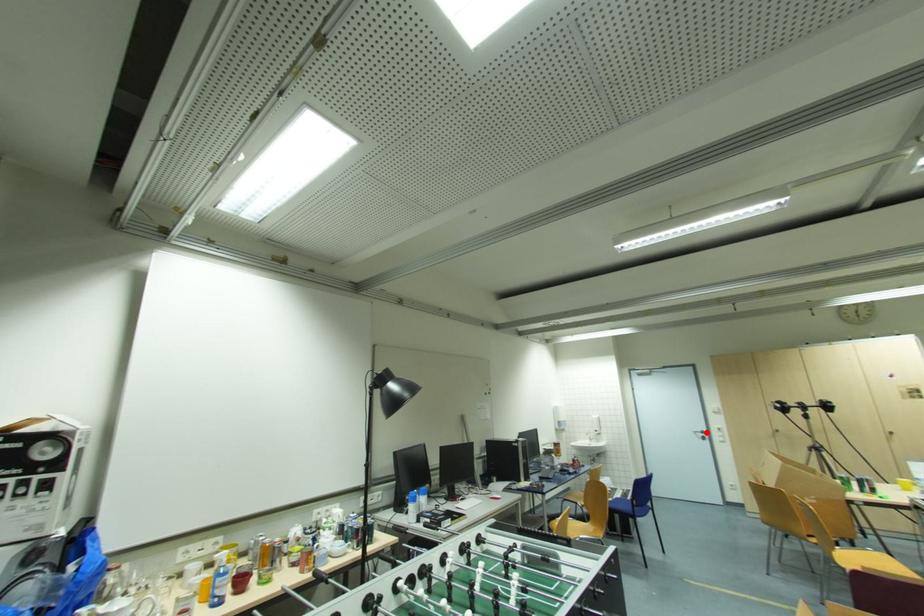
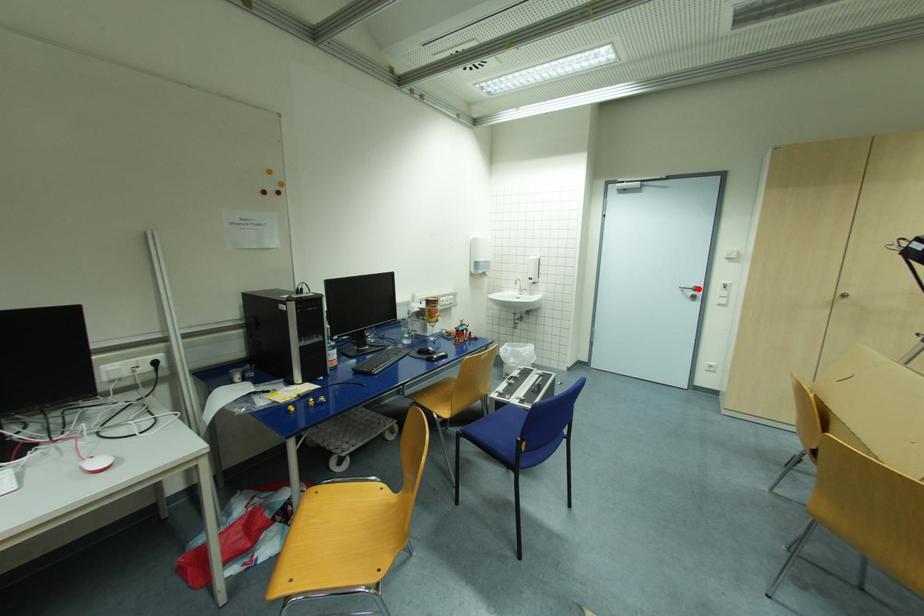
I am providing you with two images of the same scene from different viewpoints. A red point is marked on the first image and another point is marked on the second image. Does the point marked in image1 correspond to the same location as the one in image2?

Yes